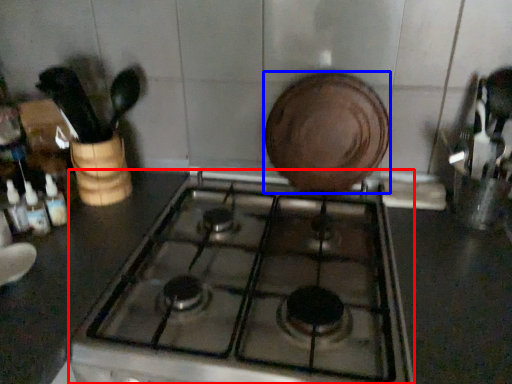
Question: Among these objects, which one is farthest to the camera, gas stove (highlighted by a red box) or kitchen appliance (highlighted by a blue box)?

Choices:
 (A) gas stove
 (B) kitchen appliance

Answer: (B)